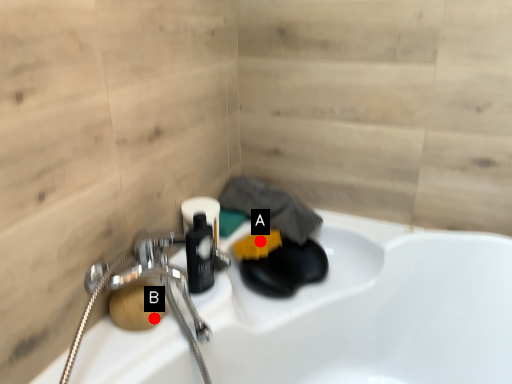
Question: Two points are circled on the image, labeled by A and B beside each circle. Which point is farther to the camera?

Choices:
 (A) A is further
 (B) B is further

Answer: (A)